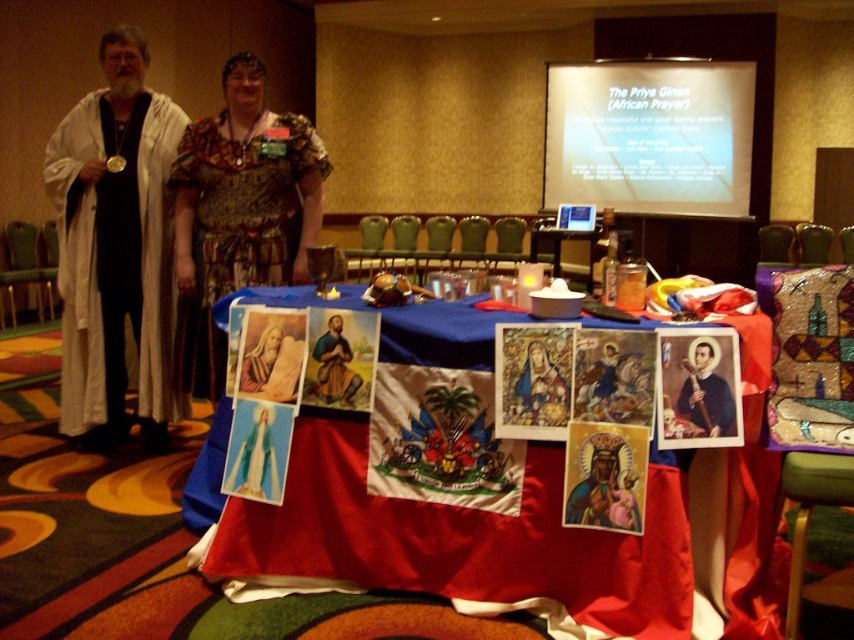
Question: Can you confirm if red satin tablecloth at center is positioned above matte paper picture at center?

Choices:
 (A) yes
 (B) no

Answer: (B)

Question: Does white cloth at left have a smaller size compared to matte stained glass at center?

Choices:
 (A) yes
 (B) no

Answer: (B)

Question: Estimate the real-world distances between objects in this image. Which object is farther from the matte black saint at center?

Choices:
 (A) matte brown wooden statue at center
 (B) white cloth at left

Answer: (B)

Question: Which is farther from the matte stained glass at center?

Choices:
 (A) matte black saint at center
 (B) red satin tablecloth at center
 (C) matte paper picture at center

Answer: (C)

Question: Is matte paper picture at center closer to camera compared to matte brown wooden statue at center?

Choices:
 (A) yes
 (B) no

Answer: (A)

Question: Among these points, which one is farthest from the camera?

Choices:
 (A) (728, 573)
 (B) (322, 371)

Answer: (B)